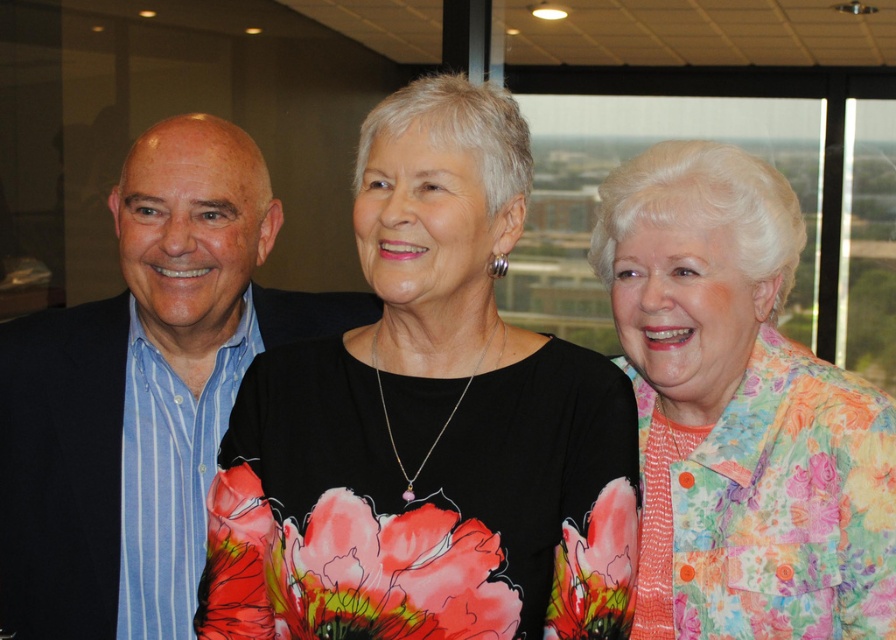
This screenshot has height=640, width=896. Describe the element at coordinates (427, 424) in the screenshot. I see `black matte dress at center` at that location.

Is point (633, 580) farther from camera compared to point (659, 614)?

No, it is not.

Find the location of `black matte dress at center`. black matte dress at center is located at coordinates (427, 424).

Can you confirm if black matte dress at center is shorter than blue striped shirt at left?

Yes, black matte dress at center is shorter than blue striped shirt at left.

Who is more forward, (376, 260) or (242, 317)?

Point (376, 260) is in front.

This screenshot has height=640, width=896. Identify the location of black matte dress at center. (427, 424).

Which is in front, point (886, 486) or point (125, 636)?

Point (886, 486) is in front.

Does floral-patterned shirt at center have a lesser width compared to blue striped shirt at left?

Yes.

Is point (845, 509) positioned before point (49, 376)?

That is True.

Where is `floral-patterned shirt at center`? floral-patterned shirt at center is located at coordinates (739, 412).